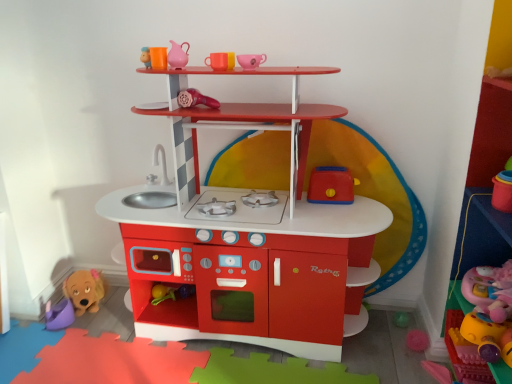
Question: Is matte plastic play kitchen at center, the 4th toy positioned from the right, not near purple plastic bucket at lower left, the 1th toy when ordered from left to right?

Choices:
 (A) no
 (B) yes

Answer: (A)

Question: From a real-world perspective, does matte plastic play kitchen at center, the fifth toy when ordered from left to right, stand above purple plastic bucket at lower left, acting as the 8th toy starting from the right?

Choices:
 (A) yes
 (B) no

Answer: (A)

Question: Is matte plastic play kitchen at center, the 4th toy positioned from the right, completely or partially outside of purple plastic bucket at lower left, acting as the 8th toy starting from the right?

Choices:
 (A) yes
 (B) no

Answer: (A)

Question: Is matte plastic play kitchen at center, the 4th toy positioned from the right, shorter than purple plastic bucket at lower left, acting as the 8th toy starting from the right?

Choices:
 (A) no
 (B) yes

Answer: (A)

Question: From the image's perspective, is matte plastic play kitchen at center, the fifth toy when ordered from left to right, on purple plastic bucket at lower left, acting as the 8th toy starting from the right?

Choices:
 (A) no
 (B) yes

Answer: (B)

Question: From a real-world perspective, is matte ceramic cup at upper center, which is counted as the fourth toy, starting from the left, above or below soft pink plush at lower right, the eighth toy viewed from the left?

Choices:
 (A) above
 (B) below

Answer: (A)

Question: Is matte ceramic cup at upper center, marked as the fifth toy in a right-to-left arrangement, spatially inside soft pink plush at lower right, positioned as the first toy in right-to-left order, or outside of it?

Choices:
 (A) inside
 (B) outside

Answer: (B)

Question: In terms of width, does matte ceramic cup at upper center, which is counted as the fourth toy, starting from the left, look wider or thinner when compared to soft pink plush at lower right, the eighth toy viewed from the left?

Choices:
 (A) wide
 (B) thin

Answer: (B)

Question: From the image's perspective, is matte ceramic cup at upper center, marked as the fifth toy in a right-to-left arrangement, located above or below soft pink plush at lower right, the eighth toy viewed from the left?

Choices:
 (A) above
 (B) below

Answer: (A)

Question: Do you think purple plastic bucket at lower left, acting as the 8th toy starting from the right, is within matte plastic play kitchen at center, the fifth toy when ordered from left to right, or outside of it?

Choices:
 (A) outside
 (B) inside

Answer: (A)

Question: From a real-world perspective, is purple plastic bucket at lower left, the 1th toy when ordered from left to right, above or below matte plastic play kitchen at center, the fifth toy when ordered from left to right?

Choices:
 (A) below
 (B) above

Answer: (A)

Question: In terms of size, does purple plastic bucket at lower left, acting as the 8th toy starting from the right, appear bigger or smaller than matte plastic play kitchen at center, the 4th toy positioned from the right?

Choices:
 (A) small
 (B) big

Answer: (A)

Question: From the image's perspective, relative to matte plastic play kitchen at center, the 4th toy positioned from the right, is purple plastic bucket at lower left, the 1th toy when ordered from left to right, above or below?

Choices:
 (A) below
 (B) above

Answer: (A)

Question: From their relative heights in the image, would you say matte plastic play kitchen at center, the fifth toy when ordered from left to right, is taller or shorter than matte ceramic cup at upper center, marked as the fifth toy in a right-to-left arrangement?

Choices:
 (A) tall
 (B) short

Answer: (A)

Question: From the image's perspective, is matte plastic play kitchen at center, the 4th toy positioned from the right, above or below matte ceramic cup at upper center, marked as the fifth toy in a right-to-left arrangement?

Choices:
 (A) above
 (B) below

Answer: (B)